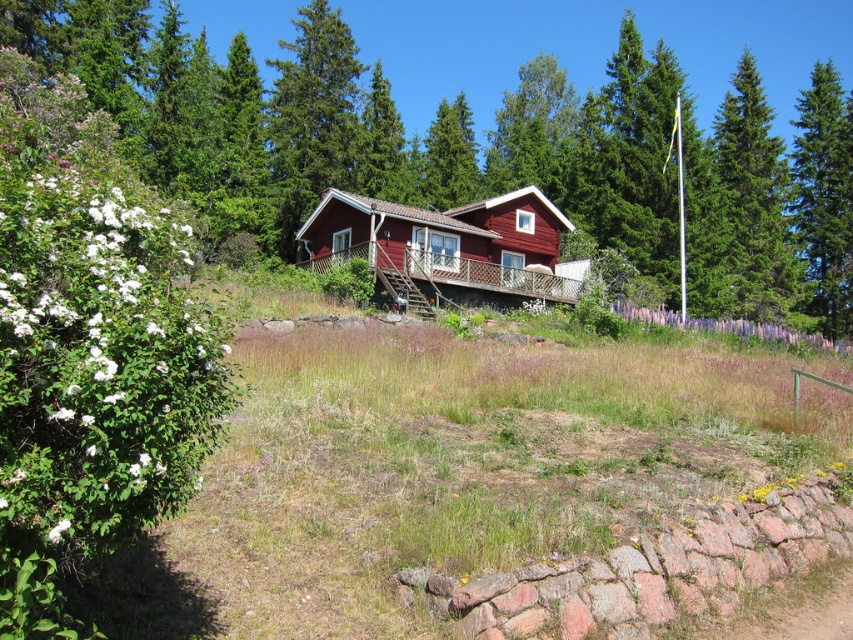
You are standing at the entrance of the matte red cabin at center and want to walk towards the green coniferous tree at right. Which direction should you move relative to the cabin?

Since the matte red cabin at center is in front of the green coniferous tree at right, you should move towards the right side of the cabin to reach the tree.

You are a gardener planning to plant a new tree in the area between the green coniferous tree at right and the purple soft grass at center. Considering their sizes, which object should you place closer to the new tree to ensure enough space?

The green coniferous tree at right is larger than the purple soft grass at center, so you should place the new tree closer to the purple soft grass at center to ensure sufficient space.